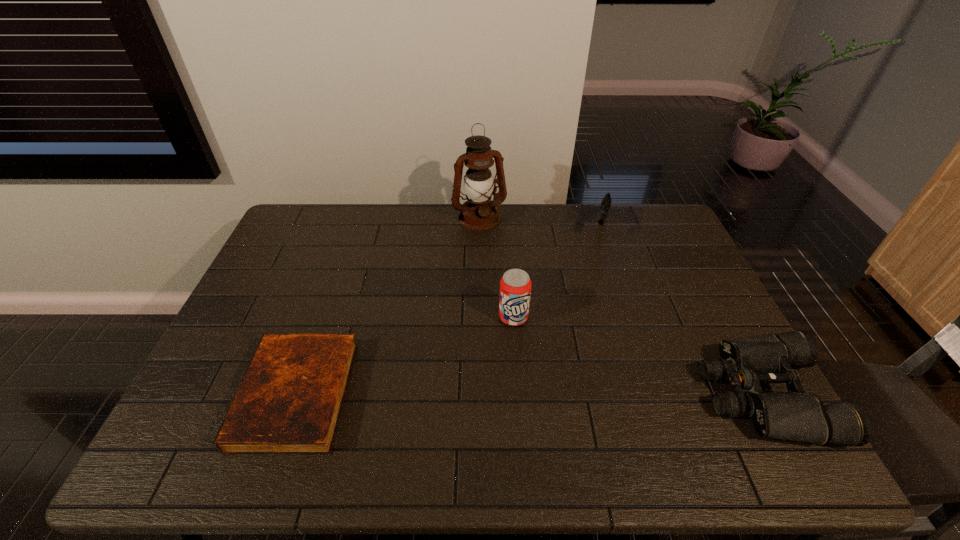
Where is `object at the near left corner`? object at the near left corner is located at coordinates (289, 401).

Where is `object present at the near right corner`? The image size is (960, 540). object present at the near right corner is located at coordinates (796, 415).

Image resolution: width=960 pixels, height=540 pixels. In the image, there is a desktop. Find the location of `blank space at the far edge`. blank space at the far edge is located at coordinates (435, 216).

Where is `vacant space at the right edge of the desktop`? Image resolution: width=960 pixels, height=540 pixels. vacant space at the right edge of the desktop is located at coordinates (710, 301).

In the image, there is a desktop. At what (x,y) coordinates should I click in order to perform the action: click on vacant space at the far left corner. Please return your answer as a coordinate pair (x, y). The width and height of the screenshot is (960, 540). Looking at the image, I should click on [x=305, y=203].

Identify the location of vacant space at the far right corner of the desktop. (640, 208).

Find the location of a particular element. The height and width of the screenshot is (540, 960). free space between the binoculars and the tallest object is located at coordinates (621, 307).

This screenshot has height=540, width=960. I want to click on vacant space in between the leftmost object and the rightmost object, so click(530, 395).

Find the location of a particular element. This screenshot has width=960, height=540. vacant area between the soda can and the Bible is located at coordinates (405, 356).

Where is `free space between the shortest object and the third shortest object`? free space between the shortest object and the third shortest object is located at coordinates (448, 310).